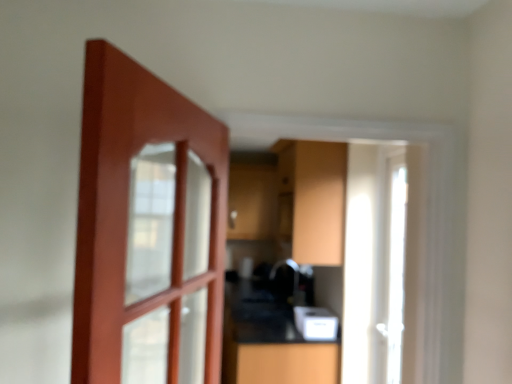
Question: Is white glossy door at right wider than matte wood cabinet at center?

Choices:
 (A) no
 (B) yes

Answer: (A)

Question: Is white glossy door at right oriented away from matte wood cabinet at center?

Choices:
 (A) no
 (B) yes

Answer: (A)

Question: From a real-world perspective, is white glossy door at right positioned under matte wood cabinet at center based on gravity?

Choices:
 (A) no
 (B) yes

Answer: (B)

Question: Is white glossy door at right positioned in front of matte wood cabinet at center?

Choices:
 (A) yes
 (B) no

Answer: (A)

Question: Is matte wood cabinet at center a part of white glossy door at right?

Choices:
 (A) no
 (B) yes

Answer: (A)

Question: Based on their sizes in the image, would you say black glossy counter at center is bigger or smaller than white plastic toaster at lower center?

Choices:
 (A) small
 (B) big

Answer: (B)

Question: From their relative heights in the image, would you say black glossy counter at center is taller or shorter than white plastic toaster at lower center?

Choices:
 (A) tall
 (B) short

Answer: (A)

Question: From a real-world perspective, is black glossy counter at center physically located above or below white plastic toaster at lower center?

Choices:
 (A) above
 (B) below

Answer: (B)

Question: In terms of width, does black glossy counter at center look wider or thinner when compared to white plastic toaster at lower center?

Choices:
 (A) wide
 (B) thin

Answer: (A)

Question: Considering the positions of matte wood cabinet at center and white glossy door at right in the image, is matte wood cabinet at center wider or thinner than white glossy door at right?

Choices:
 (A) wide
 (B) thin

Answer: (A)

Question: Is matte wood cabinet at center spatially inside white glossy door at right, or outside of it?

Choices:
 (A) inside
 (B) outside

Answer: (B)

Question: Is matte wood cabinet at center bigger or smaller than white glossy door at right?

Choices:
 (A) small
 (B) big

Answer: (A)

Question: From a real-world perspective, is matte wood cabinet at center positioned above or below white glossy door at right?

Choices:
 (A) below
 (B) above

Answer: (B)

Question: Based on their positions, is matte wood cabinet at center located to the left or right of white plastic toaster at lower center?

Choices:
 (A) right
 (B) left

Answer: (B)

Question: Is matte wood cabinet at center in front of or behind white plastic toaster at lower center in the image?

Choices:
 (A) front
 (B) behind

Answer: (A)